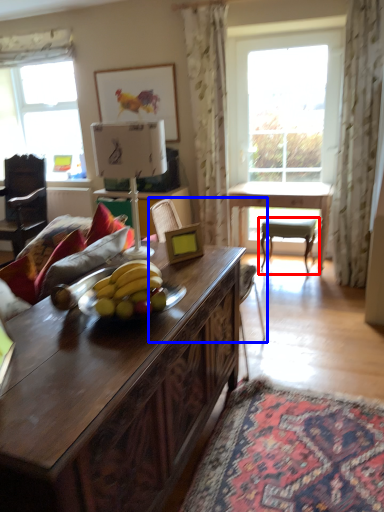
Question: Which of the following is the closest to the observer, chair (highlighted by a red box) or swivel chair (highlighted by a blue box)?

Choices:
 (A) chair
 (B) swivel chair

Answer: (B)